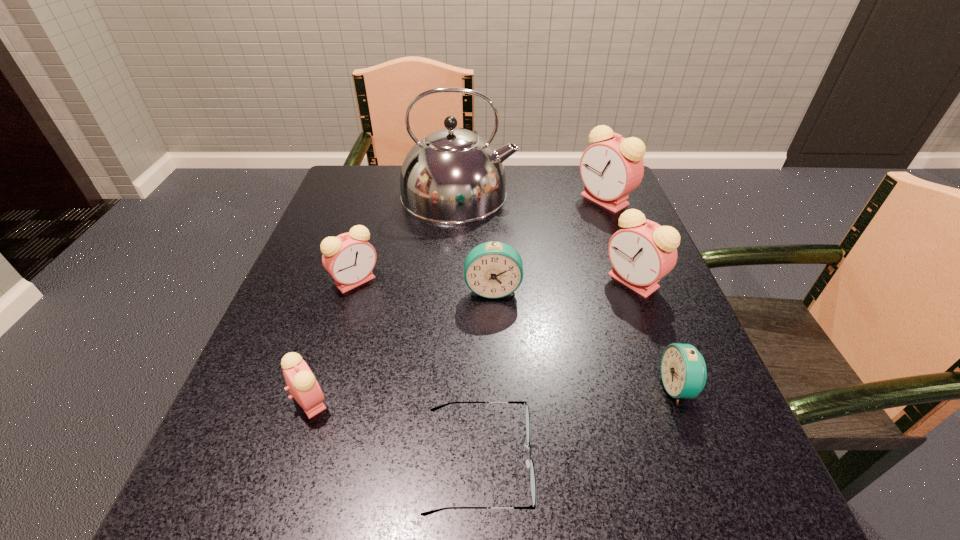
Identify the location of vacant space located 0.160m on the face of the second smallest pink alarm clock. (329, 363).

Locate an element on the screen. Image resolution: width=960 pixels, height=540 pixels. free space located on the front-facing side of the left blue alarm clock is located at coordinates (494, 325).

At what (x,y) coordinates should I click in order to perform the action: click on vacant space located 0.360m on the front-facing side of the right blue alarm clock. Please return your answer as a coordinate pair (x, y). The width and height of the screenshot is (960, 540). Looking at the image, I should click on (438, 387).

This screenshot has width=960, height=540. Find the location of `free location located 0.060m on the front-facing side of the right blue alarm clock`. free location located 0.060m on the front-facing side of the right blue alarm clock is located at coordinates (625, 387).

Find the location of a particular element. This screenshot has width=960, height=540. free region located 0.380m on the front-facing side of the right blue alarm clock is located at coordinates (425, 387).

The height and width of the screenshot is (540, 960). In order to click on free region located 0.160m on the face of the nearest pink alarm clock in this screenshot , I will do `click(435, 401)`.

Where is `vacant space situated 0.190m on the lenses of the black spectacles`? The image size is (960, 540). vacant space situated 0.190m on the lenses of the black spectacles is located at coordinates (667, 462).

At what (x,y) coordinates should I click in order to perform the action: click on kettle situated at the far edge. Please return your answer as a coordinate pair (x, y). Looking at the image, I should click on (452, 175).

At what (x,y) coordinates should I click in order to perform the action: click on alarm clock located in the far edge section of the desktop. Please return your answer as a coordinate pair (x, y). Image resolution: width=960 pixels, height=540 pixels. Looking at the image, I should click on (610, 169).

The height and width of the screenshot is (540, 960). Identify the location of object that is at the near edge. (530, 464).